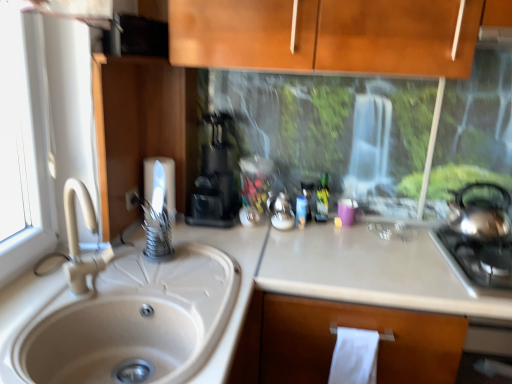
Image resolution: width=512 pixels, height=384 pixels. What do you see at coordinates (477, 259) in the screenshot?
I see `stainless steel gas stove at right` at bounding box center [477, 259].

What do you see at coordinates (322, 199) in the screenshot? Image resolution: width=512 pixels, height=384 pixels. I see `green matte bottle at center` at bounding box center [322, 199].

Describe the element at coordinates (124, 314) in the screenshot. I see `white matte sink at left` at that location.

Where is `white matte countertop at center`? white matte countertop at center is located at coordinates (375, 269).

Locate an element on the screen. Image resolution: width=512 pixels, height=384 pixels. stainless steel gas stove at right is located at coordinates (477, 259).

Which of these two, white paper towel at lower center, the 2th toilet paper viewed from the back, or green matte bottle at center, stands shorter?

Standing shorter between the two is green matte bottle at center.

Is point (341, 336) in front of point (323, 215)?

Yes, point (341, 336) is in front of point (323, 215).

Could you tell me if white paper towel at lower center, which is counted as the second toilet paper, starting from the left, is facing green matte bottle at center?

No, white paper towel at lower center, which is counted as the second toilet paper, starting from the left, is not oriented towards green matte bottle at center.

From a real-world perspective, which object rests below the other?

From a 3D spatial view, white paper towel at lower center, which is counted as the second toilet paper, starting from the left, is below.

Between white paper towel at lower center, which is counted as the second toilet paper, starting from the left, and white matte toilet paper at upper left, which appears as the second toilet paper when ordered from the bottom, which one is positioned in front?

white paper towel at lower center, which is counted as the second toilet paper, starting from the left, is closer to the camera.

From a real-world perspective, which is physically below, white matte sink at left or black plastic coffee machine at center?

white matte sink at left, from a real-world perspective.

Based on their sizes in the image, would you say white matte sink at left is bigger or smaller than black plastic coffee machine at center?

Considering their sizes, white matte sink at left takes up more space than black plastic coffee machine at center.

Identify the location of sink lying on the left of black plastic coffee machine at center. The width and height of the screenshot is (512, 384). (124, 314).

Between point (39, 366) and point (316, 207), which one is positioned behind?

Point (316, 207)

Is white matte sink at left in front of or behind green matte bottle at center in the image?

Visually, white matte sink at left is located in front of green matte bottle at center.

Identify the location of sink below the green matte bottle at center (from a real-world perspective). The image size is (512, 384). (124, 314).

Looking at this image, considering the relative sizes of green matte bottle at center and white paper towel at lower center, placed as the 1th toilet paper when sorted from bottom to top, in the image provided, is green matte bottle at center taller than white paper towel at lower center, placed as the 1th toilet paper when sorted from bottom to top,?

No, green matte bottle at center is not taller than white paper towel at lower center, placed as the 1th toilet paper when sorted from bottom to top.

Can you confirm if green matte bottle at center is wider than white paper towel at lower center, acting as the first toilet paper starting from the right?

In fact, green matte bottle at center might be narrower than white paper towel at lower center, acting as the first toilet paper starting from the right.

Looking at the image, does green matte bottle at center seem bigger or smaller compared to white paper towel at lower center, marked as the 2th toilet paper in a top-to-bottom arrangement?

green matte bottle at center is smaller than white paper towel at lower center, marked as the 2th toilet paper in a top-to-bottom arrangement.

Can you see green matte bottle at center touching white paper towel at lower center, acting as the first toilet paper starting from the right?

There is a gap between green matte bottle at center and white paper towel at lower center, acting as the first toilet paper starting from the right.

Considering the sizes of objects stainless steel gas stove at right and white matte toilet paper at upper left, which is counted as the first toilet paper, starting from the back, in the image provided, who is taller, stainless steel gas stove at right or white matte toilet paper at upper left, which is counted as the first toilet paper, starting from the back,?

white matte toilet paper at upper left, which is counted as the first toilet paper, starting from the back, is taller.

Which point is more distant from viewer, (453, 265) or (170, 198)?

The point (170, 198) is more distant.

From the image's perspective, does stainless steel gas stove at right appear lower than white matte toilet paper at upper left, which appears as the second toilet paper when ordered from the bottom?

Indeed, from the image's perspective, stainless steel gas stove at right is shown beneath white matte toilet paper at upper left, which appears as the second toilet paper when ordered from the bottom.

From a real-world perspective, is stainless steel gas stove at right on top of white matte toilet paper at upper left, which is the 2th toilet paper from right to left?

No.

Which object is thinner, green matte bottle at center or stainless steel gas stove at right?

green matte bottle at center is thinner.

Could you tell me if green matte bottle at center is facing stainless steel gas stove at right?

No, green matte bottle at center is not oriented towards stainless steel gas stove at right.

From the image's perspective, is green matte bottle at center positioned above or below stainless steel gas stove at right?

green matte bottle at center is above stainless steel gas stove at right.

Does green matte bottle at center have a greater height compared to stainless steel gas stove at right?

Yes.

At what (x,y) coordinates should I click in order to perform the action: click on bottle that is behind the white paper towel at lower center, placed as the 1th toilet paper when sorted from bottom to top. Please return your answer as a coordinate pair (x, y). Looking at the image, I should click on (322, 199).

Locate an element on the screen. The image size is (512, 384). toilet paper to the left of white paper towel at lower center, which is counted as the second toilet paper, starting from the left is located at coordinates (165, 178).

Which object lies further to the anchor point stainless steel gas stove at right, metallic silver kettle at center or white paper towel at lower center, which is counted as the first toilet paper, starting from the front?

metallic silver kettle at center is further to stainless steel gas stove at right.

Estimate the real-world distances between objects in this image. Which object is closer to white matte sink at left, white matte countertop at center or black plastic coffee machine at center?

white matte countertop at center lies closer to white matte sink at left than the other object.

Which object lies further to the anchor point black plastic coffee machine at center, white paper towel at lower center, which is counted as the second toilet paper, starting from the left, or white matte sink at left?

Among the two, white paper towel at lower center, which is counted as the second toilet paper, starting from the left, is located further to black plastic coffee machine at center.

Considering their positions, is black plastic coffee machine at center positioned closer to metallic silver kettle at center than green matte bottle at center?

green matte bottle at center is positioned closer to the anchor metallic silver kettle at center.

From the image, which object appears to be nearer to satin silver tea pot at right, stainless steel gas stove at right or white matte sink at left?

The object closer to satin silver tea pot at right is stainless steel gas stove at right.

From the image, which object appears to be farther from black plastic coffee machine at center, stainless steel gas stove at right or green matte bottle at center?

stainless steel gas stove at right is further to black plastic coffee machine at center.

From the picture: Which object lies further to the anchor point satin silver tea pot at right, white matte toilet paper at upper left, marked as the first toilet paper in a top-to-bottom arrangement, or white matte countertop at center?

white matte toilet paper at upper left, marked as the first toilet paper in a top-to-bottom arrangement, lies further to satin silver tea pot at right than the other object.

Estimate the real-world distances between objects in this image. Which object is further from green matte bottle at center, white paper towel at lower center, which is counted as the first toilet paper, starting from the front, or metallic silver kettle at center?

white paper towel at lower center, which is counted as the first toilet paper, starting from the front, lies further to green matte bottle at center than the other object.

Image resolution: width=512 pixels, height=384 pixels. Find the location of `appliance between white matte sink at left and satin silver tea pot at right`. appliance between white matte sink at left and satin silver tea pot at right is located at coordinates (281, 212).

Find the location of a particular element. toilet paper between black plastic coffee machine at center and satin silver tea pot at right from left to right is located at coordinates (354, 357).

I want to click on coffee machine situated between white matte sink at left and stainless steel gas stove at right from left to right, so click(214, 181).

At what (x,y) coordinates should I click in order to perform the action: click on appliance between black plastic coffee machine at center and white matte countertop at center vertically. Please return your answer as a coordinate pair (x, y). This screenshot has width=512, height=384. Looking at the image, I should click on (281, 212).